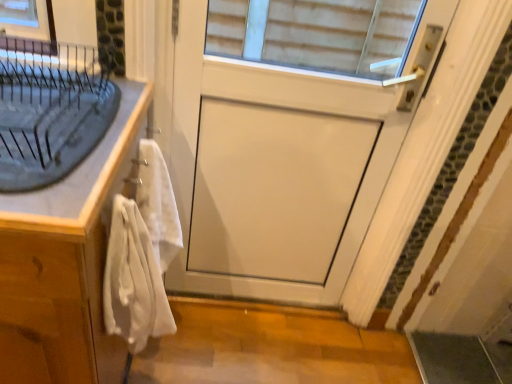
Question: Would you say white soft towel at left, which ranks as the 1th bath towel in back-to-front order, is outside white wood cabinet at left?

Choices:
 (A) no
 (B) yes

Answer: (B)

Question: From a real-world perspective, is white soft towel at left, which ranks as the 1th bath towel in back-to-front order, over white wood cabinet at left?

Choices:
 (A) yes
 (B) no

Answer: (A)

Question: Does white soft towel at left, the second bath towel positioned from the front, contain white wood cabinet at left?

Choices:
 (A) no
 (B) yes

Answer: (A)

Question: Is white wood cabinet at left at the back of white soft towel at left, the second bath towel positioned from the front?

Choices:
 (A) yes
 (B) no

Answer: (A)

Question: Considering the relative positions of white soft towel at left, which ranks as the 1th bath towel in back-to-front order, and white wood cabinet at left in the image provided, is white soft towel at left, which ranks as the 1th bath towel in back-to-front order, to the left of white wood cabinet at left from the viewer's perspective?

Choices:
 (A) no
 (B) yes

Answer: (A)

Question: Considering the positions of point (165, 178) and point (74, 105), is point (165, 178) closer or farther from the camera than point (74, 105)?

Choices:
 (A) farther
 (B) closer

Answer: (A)

Question: Considering the positions of white soft towel at left, the second bath towel positioned from the front, and matte gray sink at left in the image, is white soft towel at left, the second bath towel positioned from the front, wider or thinner than matte gray sink at left?

Choices:
 (A) thin
 (B) wide

Answer: (A)

Question: Would you say white soft towel at left, which ranks as the 1th bath towel in back-to-front order, is inside or outside matte gray sink at left?

Choices:
 (A) inside
 (B) outside

Answer: (B)

Question: Considering their positions, is white soft towel at left, the second bath towel positioned from the front, located in front of or behind matte gray sink at left?

Choices:
 (A) front
 (B) behind

Answer: (B)

Question: Does point (120, 114) appear closer or farther from the camera than point (353, 64)?

Choices:
 (A) closer
 (B) farther

Answer: (A)

Question: From a real-world perspective, relative to white matte door at center, is white wood cabinet at left vertically above or below?

Choices:
 (A) below
 (B) above

Answer: (A)

Question: Considering the relative positions of white wood cabinet at left and white matte door at center in the image provided, is white wood cabinet at left to the left or to the right of white matte door at center?

Choices:
 (A) right
 (B) left

Answer: (B)

Question: Relative to white matte door at center, is white wood cabinet at left in front or behind?

Choices:
 (A) front
 (B) behind

Answer: (A)

Question: From a real-world perspective, relative to white matte door at center, is white cotton bath towel at left, arranged as the second bath towel when viewed from the back, vertically above or below?

Choices:
 (A) below
 (B) above

Answer: (A)

Question: Relative to white matte door at center, is white cotton bath towel at left, arranged as the second bath towel when viewed from the back, in front or behind?

Choices:
 (A) behind
 (B) front

Answer: (B)